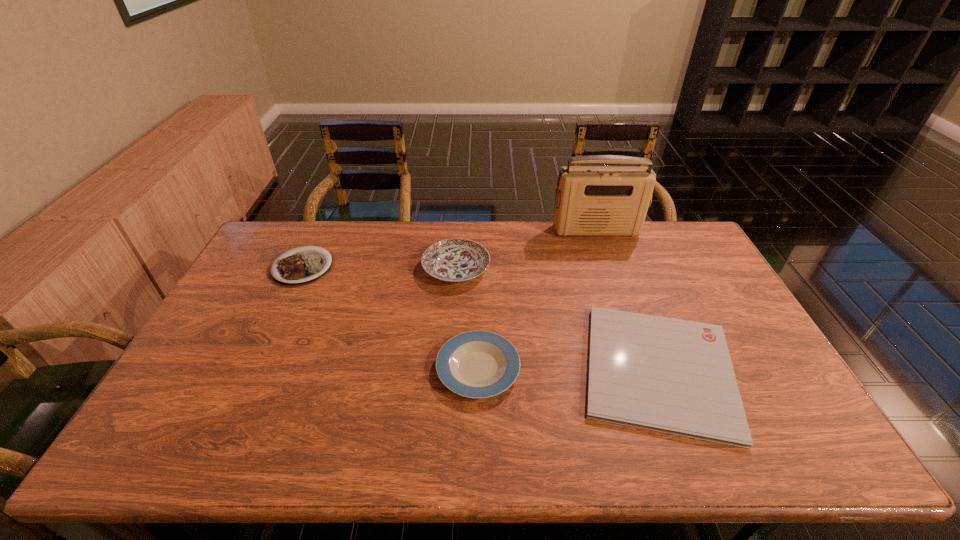
Where is `unoccupied area between the tallest plate and the clipboard`? unoccupied area between the tallest plate and the clipboard is located at coordinates (558, 319).

This screenshot has height=540, width=960. I want to click on vacant region between the tallest plate and the radio receiver, so click(x=526, y=249).

Where is `vacant area between the shortest object and the fourth shortest object`? The width and height of the screenshot is (960, 540). vacant area between the shortest object and the fourth shortest object is located at coordinates (558, 319).

Image resolution: width=960 pixels, height=540 pixels. I want to click on vacant space that is in between the leftmost plate and the tallest plate, so click(379, 267).

Locate which object ranks fourth in proximity to the clipboard. Please provide its 2D coordinates. Your answer should be formatted as a tuple, i.e. [(x, y)], where the tuple contains the x and y coordinates of a point satisfying the conditions above.

[(299, 267)]

Find the location of a particular element. This screenshot has height=540, width=960. object that ranks as the fourth closest to the second tallest object is located at coordinates (299, 267).

Locate an element on the screen. The height and width of the screenshot is (540, 960). plate object that ranks as the third closest to the tallest object is located at coordinates (299, 267).

Locate an element on the screen. The width and height of the screenshot is (960, 540). plate identified as the second closest to the tallest object is located at coordinates (476, 364).

This screenshot has height=540, width=960. What are the coordinates of `free space that satisfies the following two spatial constraints: 1. on the front side of the leftmost object; 2. on the right side of the clipboard` in the screenshot? It's located at (253, 370).

Image resolution: width=960 pixels, height=540 pixels. What are the coordinates of `vacant space that satisfies the following two spatial constraints: 1. on the front-facing side of the radio receiver; 2. on the left side of the shortest object` in the screenshot? It's located at (644, 370).